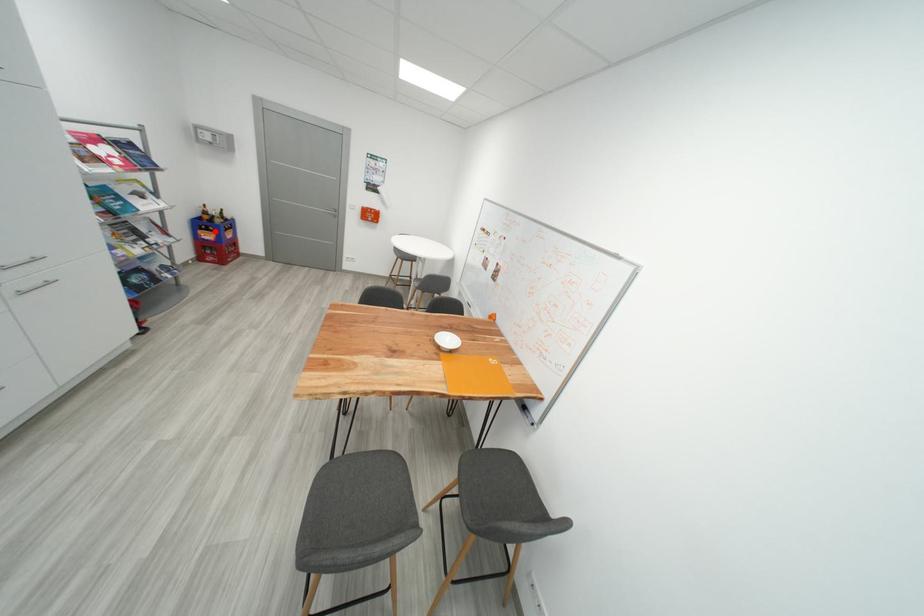
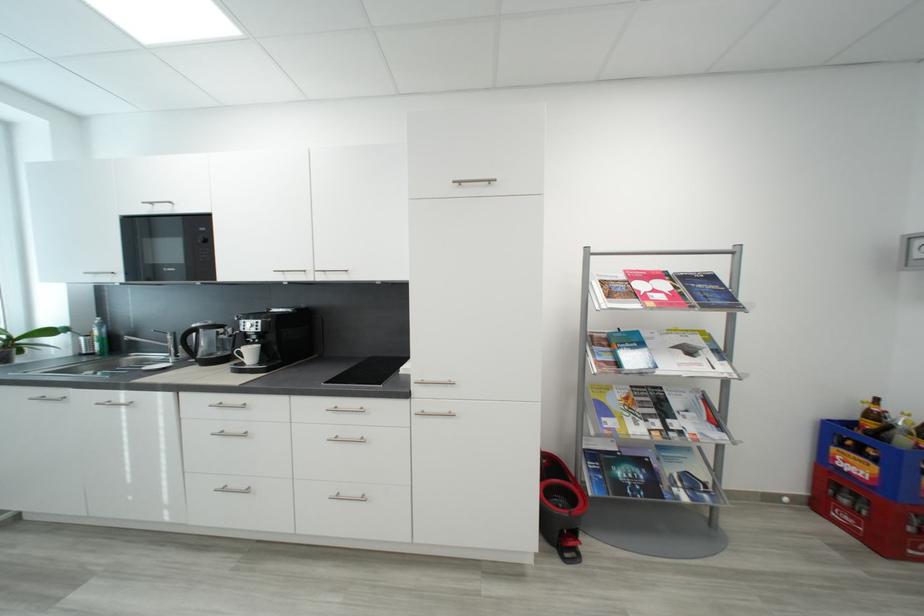
In the second image, find the point that corresponds to the highlighted location in the first image.

(867, 454)